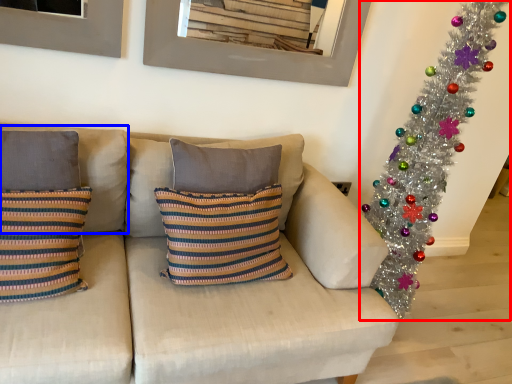
Question: Which of the following is the farthest to the observer, christmas tree (highlighted by a red box) or pillow (highlighted by a blue box)?

Choices:
 (A) christmas tree
 (B) pillow

Answer: (A)